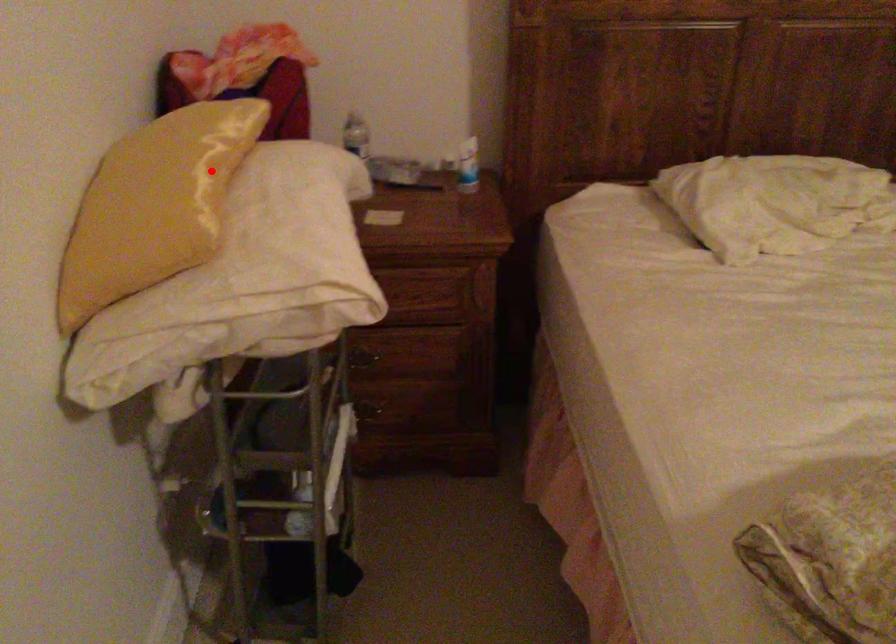
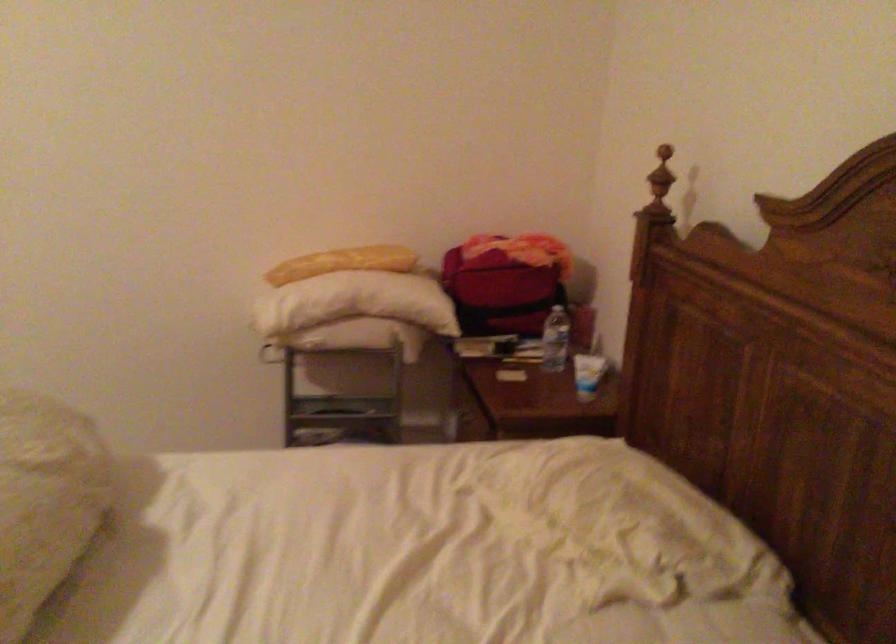
Question: I am providing you with two images of the same scene from different viewpoints. Given a red point in image1, look at the same physical point in image2. Is it:

Choices:
 (A) Closer to the viewpoint
 (B) Farther from the viewpoint

Answer: (B)